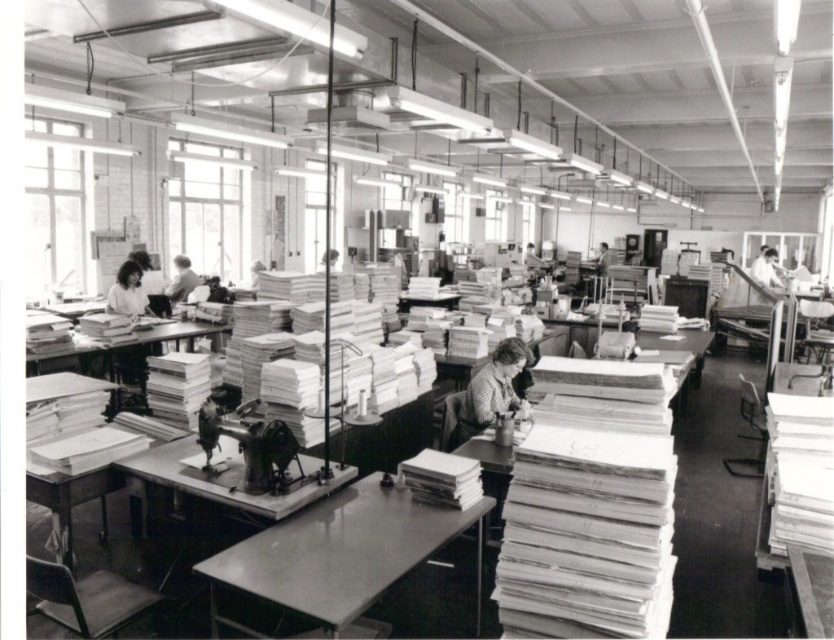
Which is above, metallic gray table at center or smooth white blouse at left?

Positioned higher is smooth white blouse at left.

Does metallic gray table at center appear on the left side of smooth white blouse at left?

No, metallic gray table at center is not to the left of smooth white blouse at left.

This screenshot has width=834, height=640. I want to click on metallic gray table at center, so click(x=340, y=554).

Is metallic gray table at center wider than patterned fabric blouse at center?

Indeed, metallic gray table at center has a greater width compared to patterned fabric blouse at center.

Does metallic gray table at center appear under patterned fabric blouse at center?

Indeed, metallic gray table at center is positioned under patterned fabric blouse at center.

Is point (194, 570) positioned after point (466, 388)?

No, it is not.

You are a GUI agent. You are given a task and a screenshot of the screen. Output one action in this format:
    pyautogui.click(x=<x>, y=<y>)
    Task: Click on the metallic gray table at center
    
    Given the screenshot: What is the action you would take?
    pyautogui.click(x=340, y=554)

Who is more distant from viewer, (x=521, y=355) or (x=128, y=259)?

The point (x=128, y=259) is more distant.

Is point (495, 406) positioned after point (138, 276)?

No, it is not.

Find the location of a particular element. This screenshot has width=834, height=640. patterned fabric blouse at center is located at coordinates (491, 388).